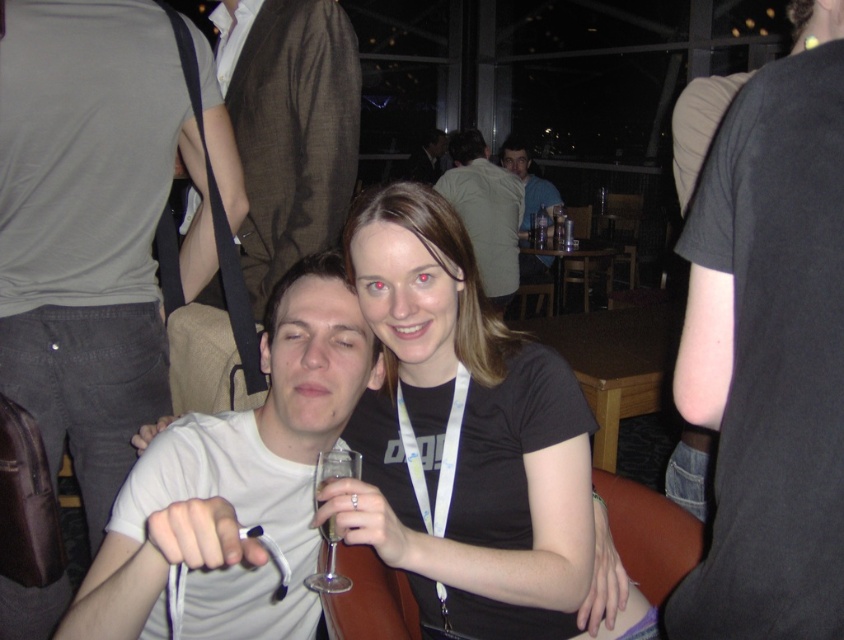
Question: Can you confirm if white matte t-shirt at left is bigger than black t-shirt at center?

Choices:
 (A) yes
 (B) no

Answer: (A)

Question: In this image, where is white matte t-shirt at center located relative to light brown leather jacket at upper center?

Choices:
 (A) left
 (B) right

Answer: (A)

Question: Which object appears closest to the camera in this image?

Choices:
 (A) white matte t-shirt at left
 (B) transparent glass wine glass at center
 (C) matte brown vest at upper center

Answer: (B)

Question: Does black matte shirt at center have a lesser width compared to white matte t-shirt at center?

Choices:
 (A) yes
 (B) no

Answer: (B)

Question: Which object is farther from the camera taking this photo?

Choices:
 (A) white matte t-shirt at center
 (B) black matte shirt at center
 (C) transparent glass wine glass at center
 (D) light brown leather jacket at upper center

Answer: (D)

Question: Which point is closer to the camera?

Choices:
 (A) light brown leather jacket at upper center
 (B) brown fabric vest at upper center

Answer: (B)